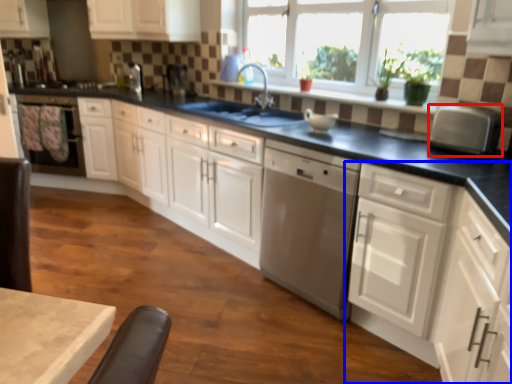
Question: Which of the following is the closest to the observer, kitchen appliance (highlighted by a red box) or cabinetry (highlighted by a blue box)?

Choices:
 (A) kitchen appliance
 (B) cabinetry

Answer: (B)